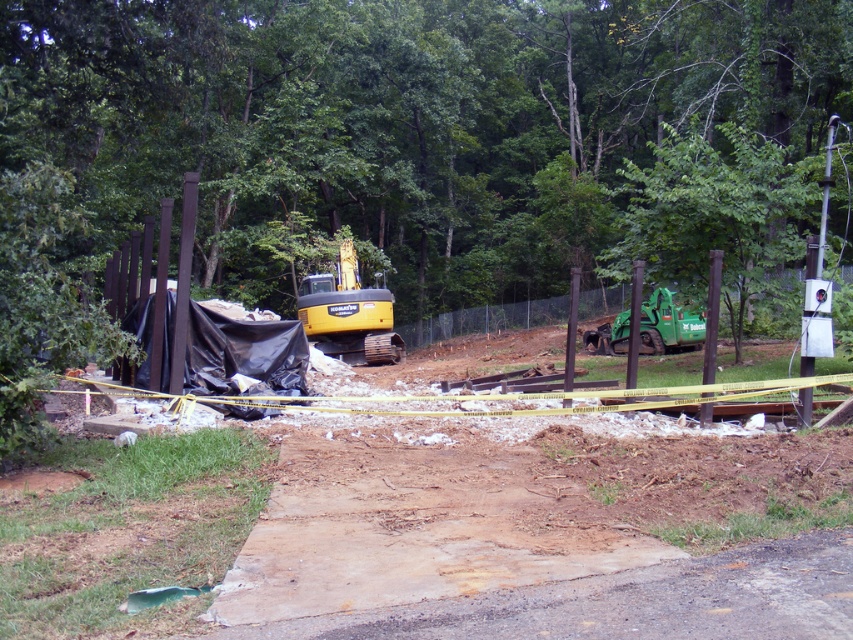
Question: Can you confirm if green leafy tree at upper center is wider than yellow rubber excavator at center?

Choices:
 (A) no
 (B) yes

Answer: (B)

Question: Which point is closer to the camera?

Choices:
 (A) (306, 307)
 (B) (631, 90)

Answer: (A)

Question: In this image, where is green leafy tree at upper center located relative to yellow rubber excavator at center?

Choices:
 (A) above
 (B) below

Answer: (A)

Question: Does green leafy tree at upper center appear under yellow rubber excavator at center?

Choices:
 (A) no
 (B) yes

Answer: (A)

Question: Which of the following is the farthest from the observer?

Choices:
 (A) yellow rubber excavator at center
 (B) green leafy tree at upper center

Answer: (A)